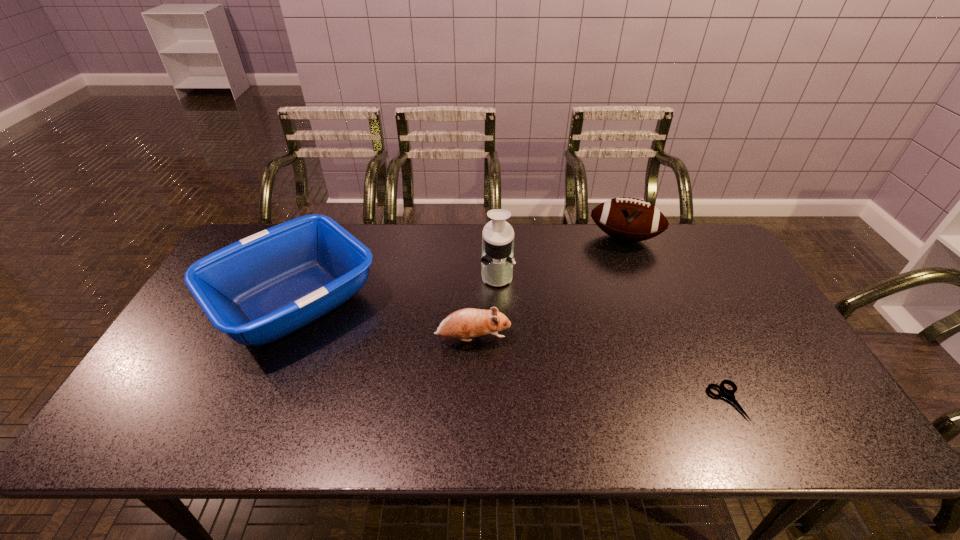
Identify the location of free location at the near right corner of the desktop. (835, 439).

The image size is (960, 540). Find the location of `empty space between the juicer and the shears`. empty space between the juicer and the shears is located at coordinates (612, 338).

The height and width of the screenshot is (540, 960). In order to click on free area in between the football (American) and the shears in this screenshot , I will do `click(676, 320)`.

The image size is (960, 540). What are the coordinates of `empty space that is in between the shortest object and the second shortest object` in the screenshot? It's located at (600, 370).

At what (x,y) coordinates should I click in order to perform the action: click on empty location between the football (American) and the tallest object. Please return your answer as a coordinate pair (x, y). Looking at the image, I should click on (561, 256).

Image resolution: width=960 pixels, height=540 pixels. What are the coordinates of `free spot between the football (American) and the juicer` in the screenshot? It's located at [x=561, y=256].

This screenshot has width=960, height=540. What are the coordinates of `vacant area between the nearest object and the tray` in the screenshot? It's located at (511, 351).

Identify the location of free space that is in between the second shortest object and the shortest object. The height and width of the screenshot is (540, 960). (600, 370).

What are the coordinates of `unoccupied area between the tray and the shortest object` in the screenshot? It's located at (511, 351).

Find the location of a particular element. The image size is (960, 540). free space between the nearest object and the leftmost object is located at coordinates (511, 351).